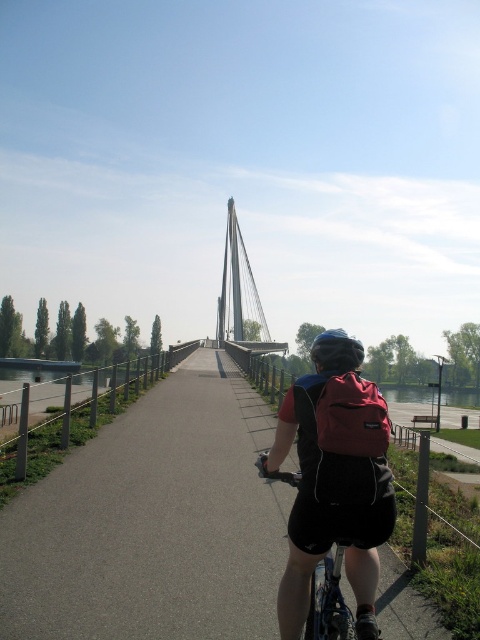
Does black asphalt path at center come behind silver metallic suspension bridge at center?

No, black asphalt path at center is in front of silver metallic suspension bridge at center.

Is black asphalt path at center to the left of silver metallic suspension bridge at center from the viewer's perspective?

Incorrect, black asphalt path at center is not on the left side of silver metallic suspension bridge at center.

The width and height of the screenshot is (480, 640). What are the coordinates of `black asphalt path at center` in the screenshot? It's located at (154, 522).

Where is `black asphalt path at center`? The image size is (480, 640). black asphalt path at center is located at coordinates (154, 522).

Looking at this image, does black asphalt path at center appear under matte black backpack at center?

Correct, black asphalt path at center is located below matte black backpack at center.

Locate an element on the screen. This screenshot has height=640, width=480. black asphalt path at center is located at coordinates (154, 522).

Find the location of a particular element. Image resolution: width=480 pixels, height=640 pixels. black asphalt path at center is located at coordinates (154, 522).

The image size is (480, 640). I want to click on black asphalt path at center, so click(x=154, y=522).

Consider the image. Does matte black backpack at center appear on the left side of matte black helmet at center?

Yes, matte black backpack at center is to the left of matte black helmet at center.

Is matte black backpack at center smaller than matte black helmet at center?

Indeed, matte black backpack at center has a smaller size compared to matte black helmet at center.

In order to click on matte black backpack at center in this screenshot , I will do (x=334, y=477).

The height and width of the screenshot is (640, 480). Find the location of `matte black backpack at center`. matte black backpack at center is located at coordinates (334, 477).